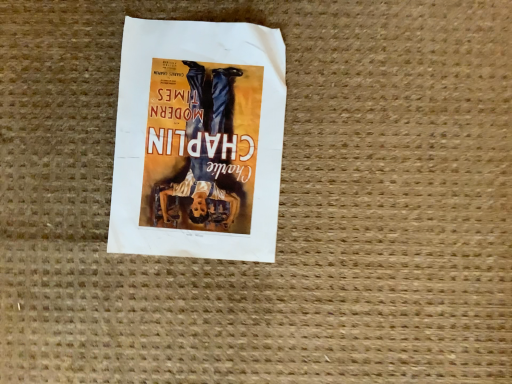
Where is `free space above matte paper poster at center (from a real-world perspective)`? This screenshot has height=384, width=512. free space above matte paper poster at center (from a real-world perspective) is located at coordinates (192, 138).